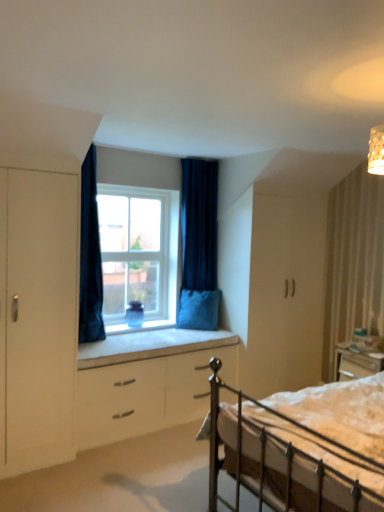
Question: From the image's perspective, is velvet blue pillow at window located above white cushioned window sill at center?

Choices:
 (A) no
 (B) yes

Answer: (B)

Question: Can you confirm if velvet blue pillow at window is smaller than white cushioned window sill at center?

Choices:
 (A) yes
 (B) no

Answer: (A)

Question: Is velvet blue pillow at window not within white cushioned window sill at center?

Choices:
 (A) no
 (B) yes

Answer: (B)

Question: Is velvet blue pillow at window shorter than white cushioned window sill at center?

Choices:
 (A) yes
 (B) no

Answer: (B)

Question: Is velvet blue pillow at window far away from white cushioned window sill at center?

Choices:
 (A) no
 (B) yes

Answer: (A)

Question: In terms of size, does dark blue velvet curtain at upper center, which is the first curtain from left to right, appear bigger or smaller than white cushioned window sill at center?

Choices:
 (A) small
 (B) big

Answer: (B)

Question: Is point pos(82,250) closer or farther from the camera than point pos(125,352)?

Choices:
 (A) farther
 (B) closer

Answer: (B)

Question: From their relative heights in the image, would you say dark blue velvet curtain at upper center, placed as the 1th curtain when sorted from front to back, is taller or shorter than white cushioned window sill at center?

Choices:
 (A) tall
 (B) short

Answer: (A)

Question: From a real-world perspective, relative to white cushioned window sill at center, is dark blue velvet curtain at upper center, placed as the 1th curtain when sorted from front to back, vertically above or below?

Choices:
 (A) below
 (B) above

Answer: (B)

Question: Would you say velvet blue pillow at window is inside or outside metallic silver bed at lower right?

Choices:
 (A) inside
 (B) outside

Answer: (B)

Question: In terms of width, does velvet blue pillow at window look wider or thinner when compared to metallic silver bed at lower right?

Choices:
 (A) wide
 (B) thin

Answer: (B)

Question: From a real-world perspective, is velvet blue pillow at window physically located above or below metallic silver bed at lower right?

Choices:
 (A) below
 (B) above

Answer: (B)

Question: Relative to metallic silver bed at lower right, is velvet blue pillow at window in front or behind?

Choices:
 (A) behind
 (B) front

Answer: (A)

Question: Visually, is velvet dark blue curtain at center, the first curtain viewed from the right, positioned to the left or to the right of velvet blue pillow at window?

Choices:
 (A) left
 (B) right

Answer: (A)

Question: Is velvet dark blue curtain at center, which is counted as the 2th curtain, starting from the front, in front of or behind velvet blue pillow at window in the image?

Choices:
 (A) behind
 (B) front

Answer: (B)